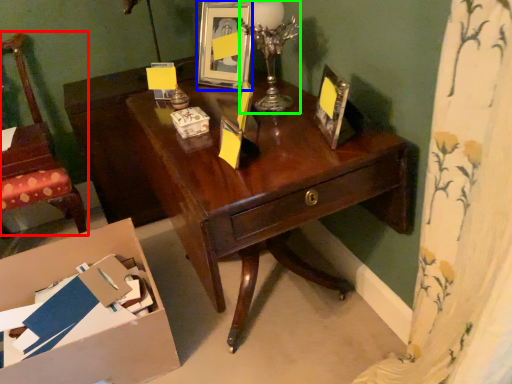
Question: Which object is the farthest from chair (highlighted by a red box)? Choose among these: picture frame (highlighted by a blue box) or candle holder (highlighted by a green box).

Choices:
 (A) picture frame
 (B) candle holder

Answer: (B)